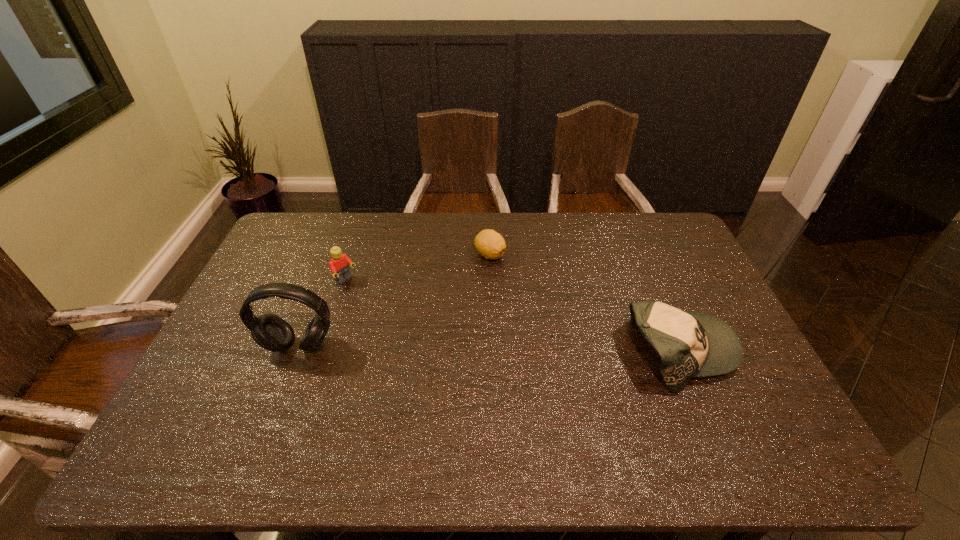
Locate an element on the screen. This screenshot has height=540, width=960. blank space that satisfies the following two spatial constraints: 1. on the earcups of the tallest object; 2. on the front-facing side of the rightmost object is located at coordinates (297, 352).

Identify the location of vacant space that satisfies the following two spatial constraints: 1. on the earcups of the headset; 2. on the front-facing side of the baseball cap. Image resolution: width=960 pixels, height=540 pixels. (297, 352).

Locate an element on the screen. The width and height of the screenshot is (960, 540). free spot that satisfies the following two spatial constraints: 1. on the earcups of the headset; 2. on the front-facing side of the rightmost object is located at coordinates (297, 352).